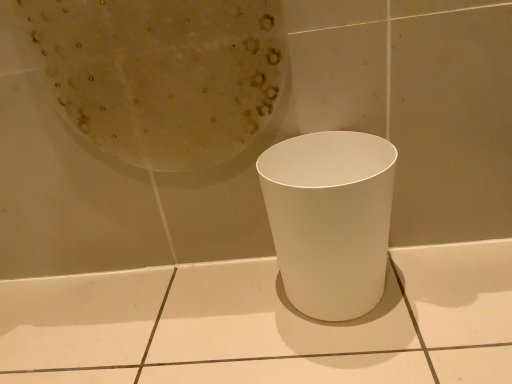
Image resolution: width=512 pixels, height=384 pixels. In order to click on free space in front of white matte waste container at center in this screenshot , I will do `click(376, 360)`.